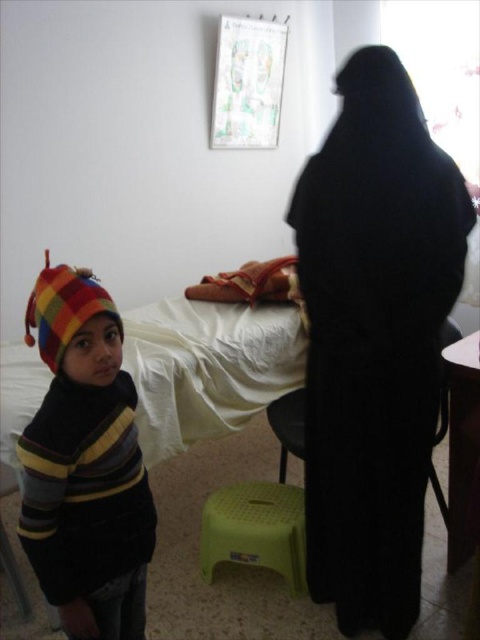
You are a delivery person who needs to place a small package on the floor between the green plastic stool at lower center and the black plastic chair at lower center. Is there enough space for the package?

The green plastic stool at lower center might be wider than the black plastic chair at lower center, so there may not be enough space between them for the package.

You are a person who is 1.6 meters tall. You want to sit on one of the two seats available in the room. The seats are the green plastic stool at lower center and the black plastic chair at lower center. Which seat should you choose to have a better view of the television placed on the wall above the bed?

The black plastic chair at lower center is taller than the green plastic stool at lower center, so choosing the black plastic chair at lower center would provide a better view of the television placed on the wall above the bed.